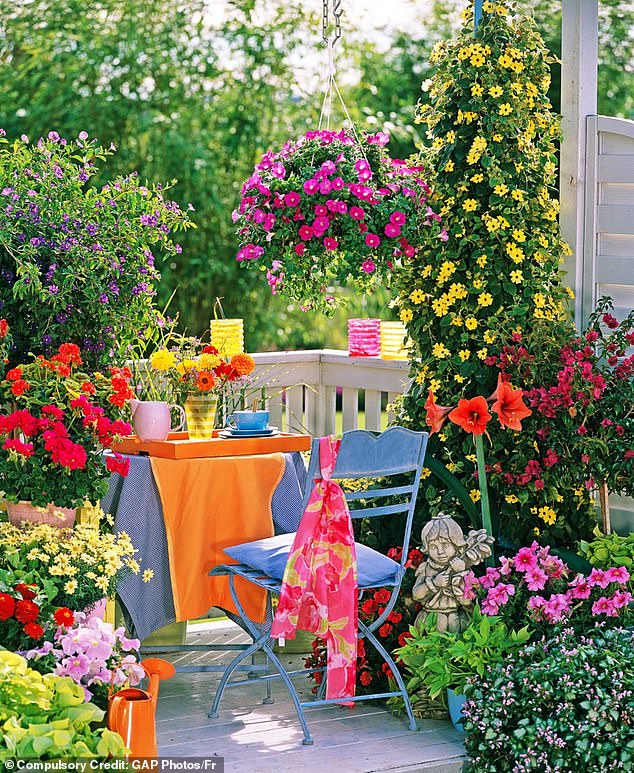
Find the location of `mug`. mug is located at coordinates (253, 419).